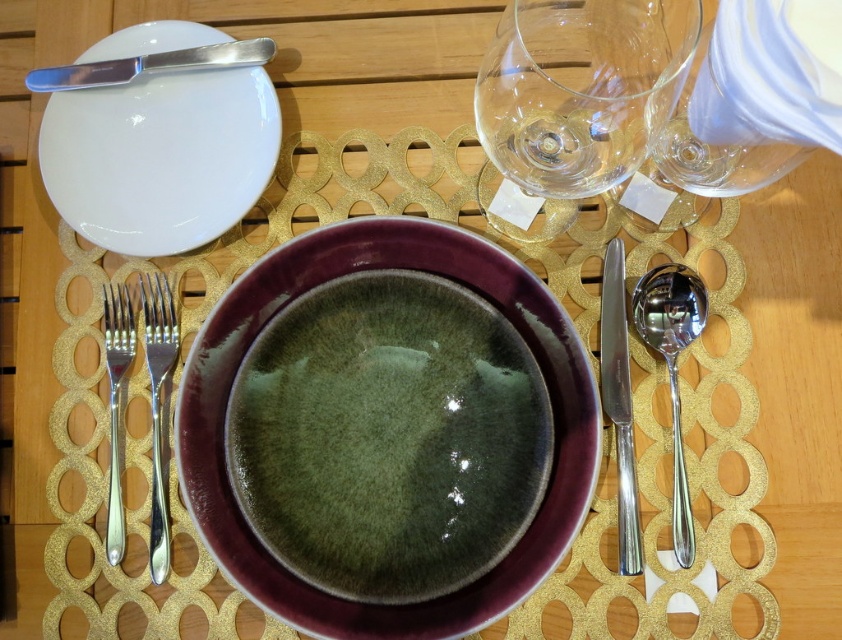
You are setting up a table for a dinner party and need to place a napkin between the transparent glass wine glass at upper right and the satin silver spoon at right. What is the minimum length of the napkin required to fit between them?

The transparent glass wine glass at upper right is 2.96 inches away from the satin silver spoon at right, so the napkin must be at least 2.96 inches long to fit between them.

You are setting up a table for a dinner party and need to place a 5 inch long decorative ribbon between the white glossy plate at upper left and the transparent glass wine glass at upper right. Will the ribbon fit perfectly between them without overlapping either item?

The white glossy plate at upper left and transparent glass wine glass at upper right are 4.91 inches apart from each other. Since the ribbon is 5 inches long, it will be slightly too long and may overlap the items when placed between them.

You are a waiter setting up a table. You need to place a napkin exactly at the midpoint between the satin silver spoon at right and the edge of the table. What is the coordinate of that midpoint?

The midpoint between the satin silver spoon at right and the edge of the table is at coordinate point (672, 368).